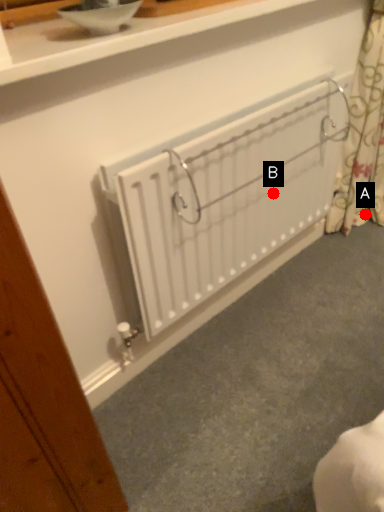
Question: Two points are circled on the image, labeled by A and B beside each circle. Which of the following is the farthest from the observer?

Choices:
 (A) A is further
 (B) B is further

Answer: (A)